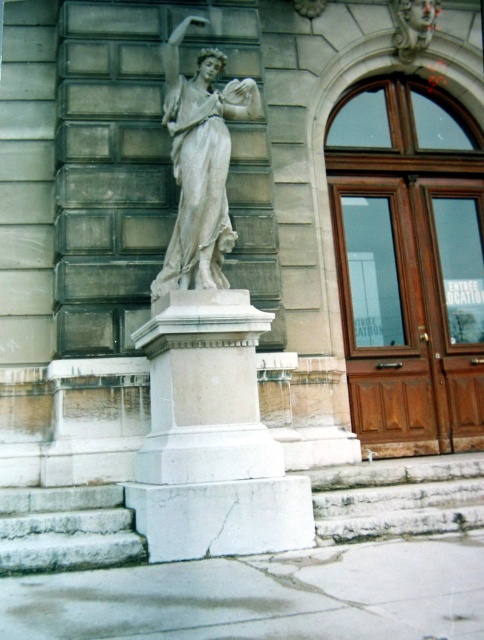
Question: Which object appears farthest from the camera in this image?

Choices:
 (A) white marble pedestal at center
 (B) white marble statue at center

Answer: (B)

Question: Which of the following is the farthest from the observer?

Choices:
 (A) white marble statue at center
 (B) white marble stairs at lower center
 (C) white marble pedestal at center

Answer: (A)

Question: Does white marble pedestal at center have a larger size compared to white marble statue at center?

Choices:
 (A) no
 (B) yes

Answer: (B)

Question: Observing the image, what is the correct spatial positioning of white marble pedestal at center in reference to white marble stairs at lower center?

Choices:
 (A) right
 (B) left

Answer: (B)

Question: Estimate the real-world distances between objects in this image. Which object is farther from the white marble statue at center?

Choices:
 (A) white marble pedestal at center
 (B) white marble stairs at lower center

Answer: (B)

Question: Observing the image, what is the correct spatial positioning of white marble stairs at lower center in reference to white marble statue at center?

Choices:
 (A) left
 (B) right

Answer: (B)